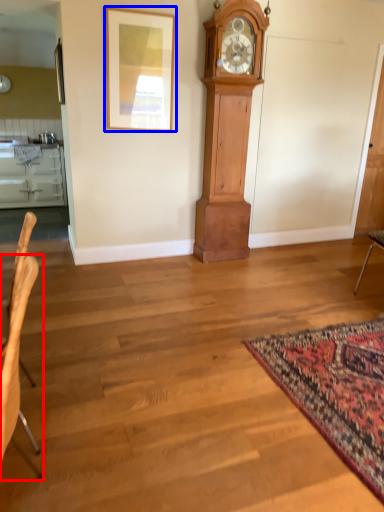
Question: Which object is closer to the camera taking this photo, chair (highlighted by a red box) or picture frame (highlighted by a blue box)?

Choices:
 (A) chair
 (B) picture frame

Answer: (A)